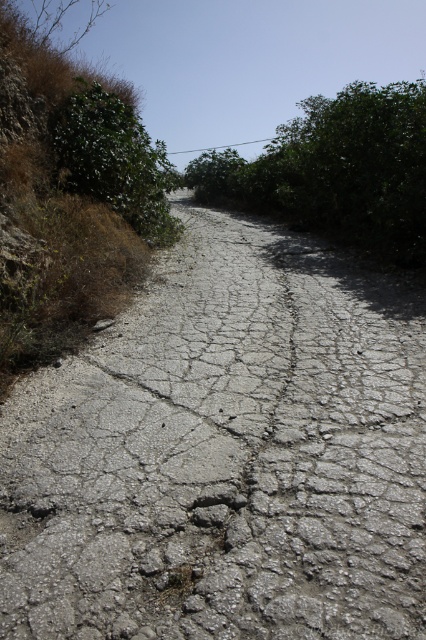
Is point (420, 356) positioned after point (155, 141)?

That is False.

Who is more distant from viewer, (158, 515) or (144, 224)?

Point (144, 224)

At what (x,y) coordinates should I click in order to perform the action: click on cracked concrete road at center. Please return your answer as a coordinate pair (x, y). The height and width of the screenshot is (640, 426). Looking at the image, I should click on (224, 452).

The image size is (426, 640). I want to click on cracked concrete road at center, so tap(224, 452).

Does cracked concrete road at center have a lesser width compared to green leafy bush at center?

Indeed, cracked concrete road at center has a lesser width compared to green leafy bush at center.

The image size is (426, 640). Describe the element at coordinates (224, 452) in the screenshot. I see `cracked concrete road at center` at that location.

This screenshot has height=640, width=426. Identify the location of cracked concrete road at center. tap(224, 452).

Find the location of a particular element. cracked concrete road at center is located at coordinates (224, 452).

Does green leafy bush at center come behind green leafy bush at upper left?

That is True.

Which is behind, point (259, 202) or point (141, 196)?

The point (259, 202) is more distant.

Where is `green leafy bush at center`? green leafy bush at center is located at coordinates (336, 170).